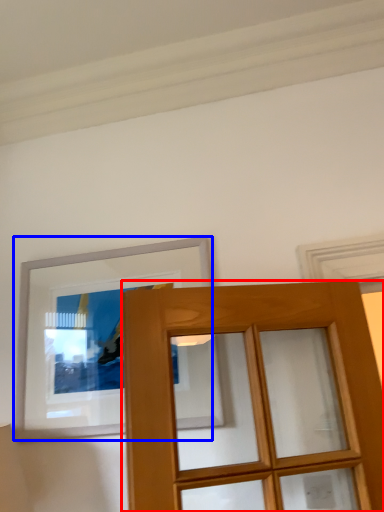
Question: Which object is further to the camera taking this photo, door (highlighted by a red box) or picture frame (highlighted by a blue box)?

Choices:
 (A) door
 (B) picture frame

Answer: (B)